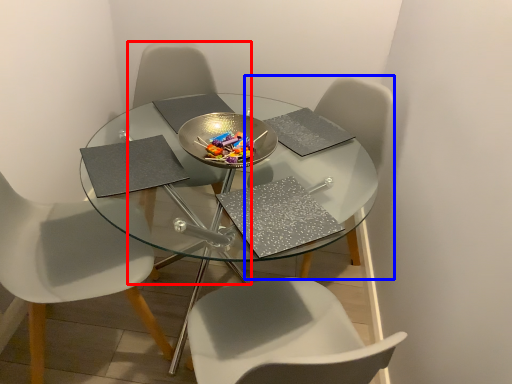
Question: Which object appears farthest to the camera in this image, chair (highlighted by a red box) or chair (highlighted by a blue box)?

Choices:
 (A) chair
 (B) chair

Answer: (A)